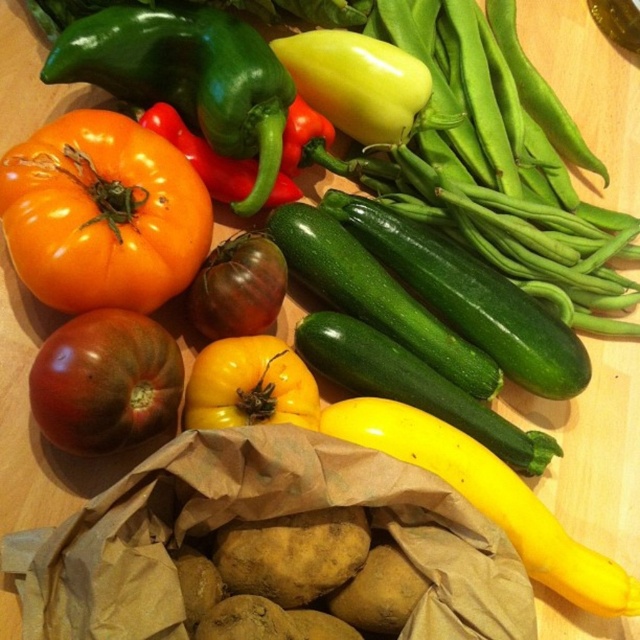
You are arranging vegetables on a wooden surface and notice the yellow matte tomato at center and the green glossy pepper at upper center. Which vegetable is located to the right of the other?

The yellow matte tomato at center is positioned on the right side of green glossy pepper at upper center.